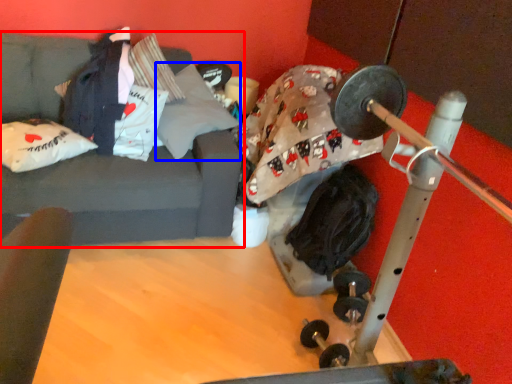
Question: Which object appears closest to the camera in this image, studio couch (highlighted by a red box) or pillow (highlighted by a blue box)?

Choices:
 (A) studio couch
 (B) pillow

Answer: (A)